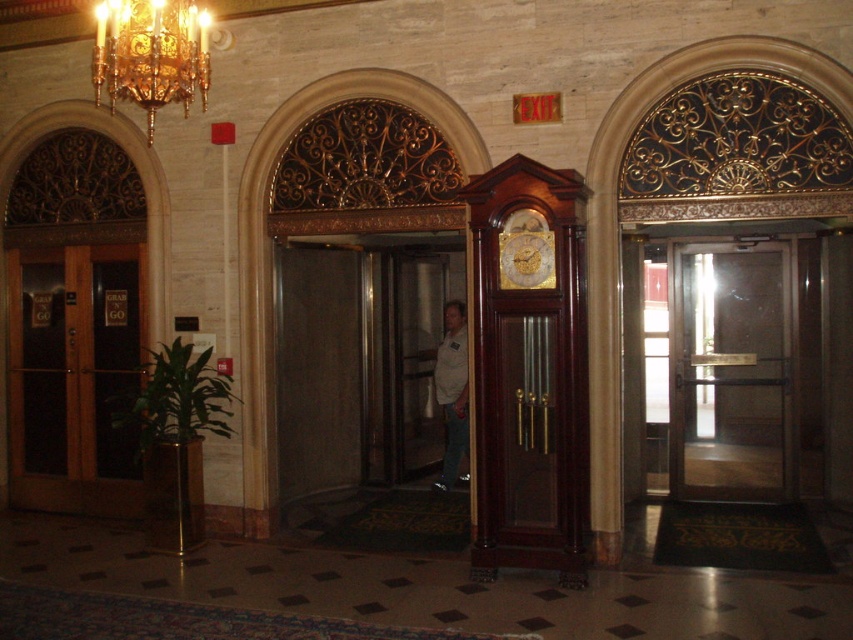
You are an interior designer planning to place a new sofa in this elegant space. You want to ensure there is enough space between the mahogany wood grandfather clock at center and the gold crystal chandelier at upper left for the sofa to fit. The sofa you have chosen is 2 meters long. Can you place the sofa between them?

The mahogany wood grandfather clock at center is 2.40 meters away from the gold crystal chandelier at upper left. Since the sofa is 2 meters long, there is sufficient space between them to place the sofa.